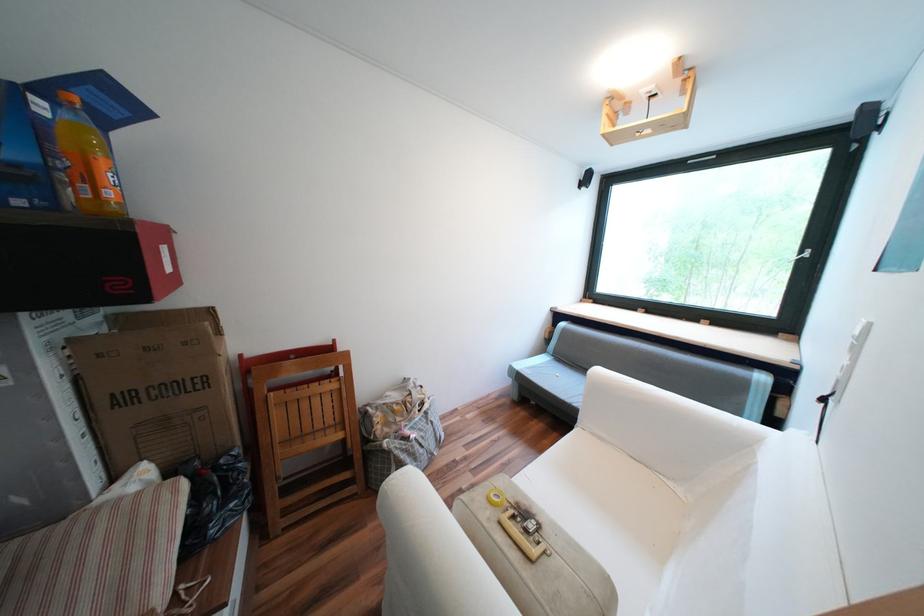
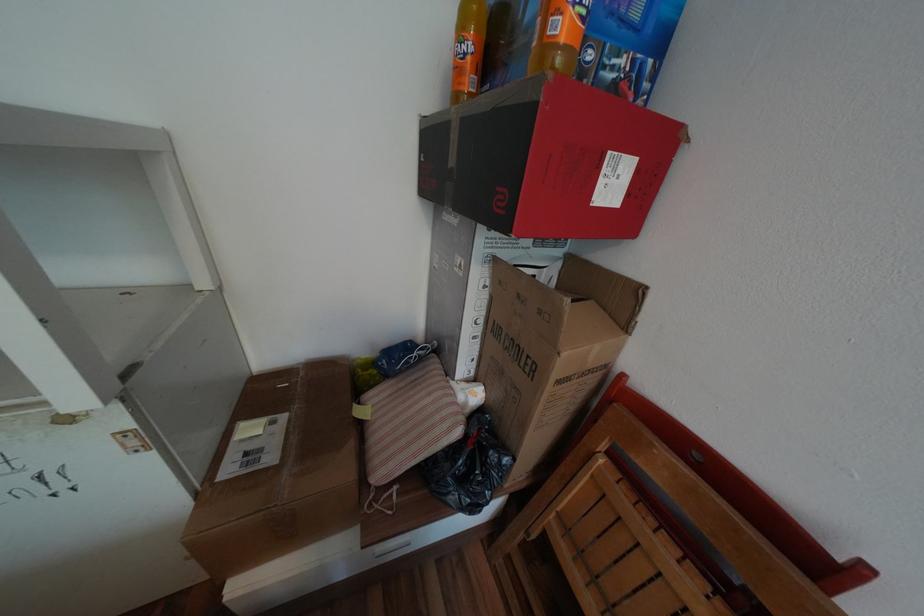
The point at (x=193, y=342) is marked in the first image. Where is the corresponding point in the second image?

(550, 312)